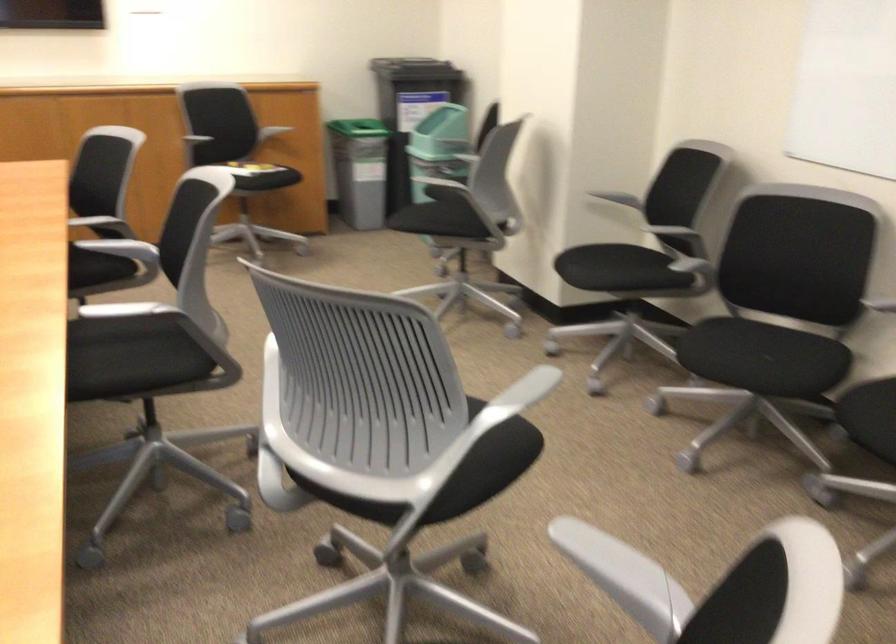
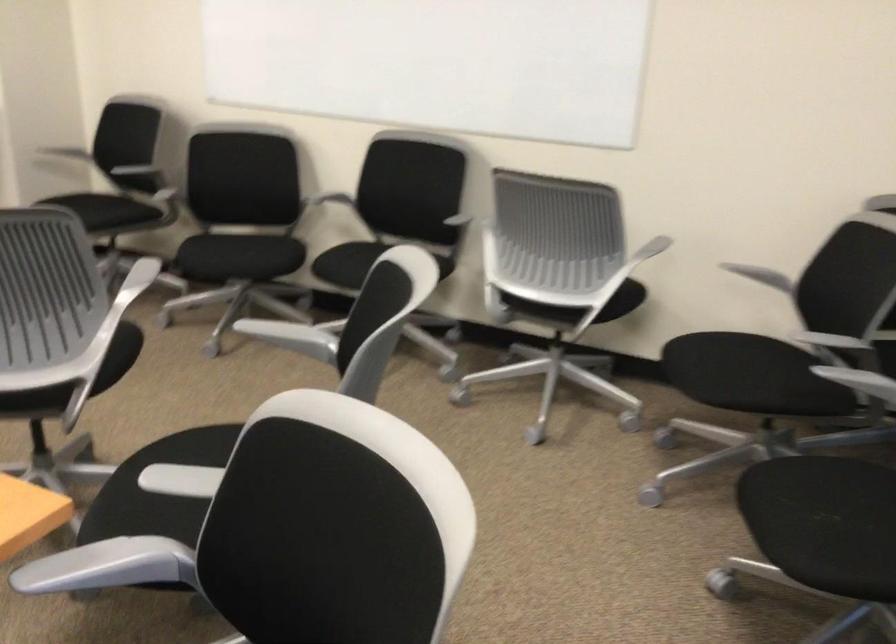
Where in the second image is the point corresponding to [730,357] from the first image?

(237, 257)